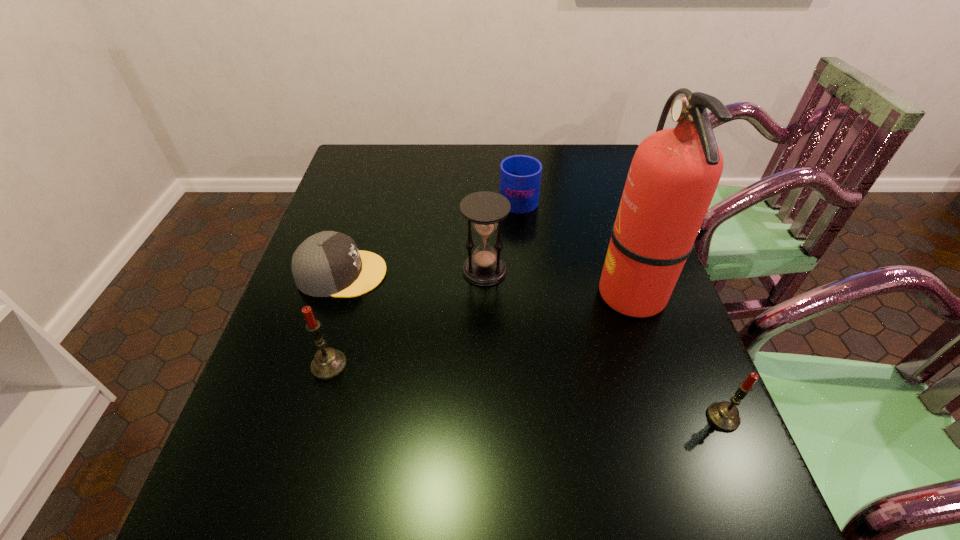
Identify which object is the second closest to the fourth tallest object. Please provide its 2D coordinates. Your answer should be formatted as a tuple, i.e. [(x, y)], where the tuple contains the x and y coordinates of a point satisfying the conditions above.

[(486, 210)]

Where is `free region that satisfies the following two spatial constraints: 1. on the front-facing side of the farther candle; 2. on the left side of the cap`? free region that satisfies the following two spatial constraints: 1. on the front-facing side of the farther candle; 2. on the left side of the cap is located at coordinates (313, 366).

Where is `free space that satisfies the following two spatial constraints: 1. on the side of the nearest object with the nozzle and handle; 2. on the right side of the tallest object`? Image resolution: width=960 pixels, height=540 pixels. free space that satisfies the following two spatial constraints: 1. on the side of the nearest object with the nozzle and handle; 2. on the right side of the tallest object is located at coordinates point(673,417).

Locate an element on the screen. vacant point that satisfies the following two spatial constraints: 1. on the front side of the right candle; 2. on the right side of the hourglass is located at coordinates (486, 417).

Where is `free location that satisfies the following two spatial constraints: 1. on the side of the tallest object with the nozzle and handle; 2. on the left side of the third shortest object`? The width and height of the screenshot is (960, 540). free location that satisfies the following two spatial constraints: 1. on the side of the tallest object with the nozzle and handle; 2. on the left side of the third shortest object is located at coordinates (673, 417).

Image resolution: width=960 pixels, height=540 pixels. What are the coordinates of `free space that satisfies the following two spatial constraints: 1. on the back side of the farther candle; 2. on the front-facing side of the cap` in the screenshot? It's located at (355, 273).